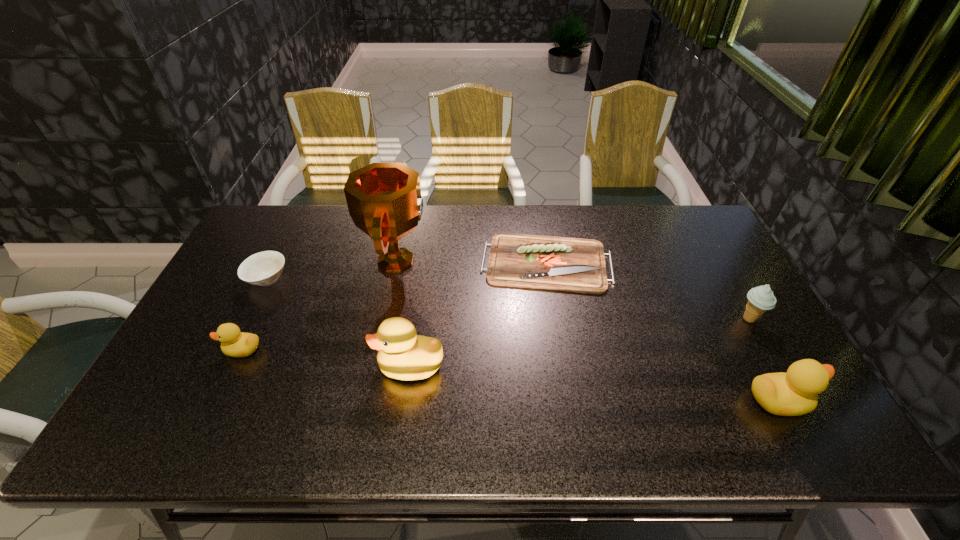
The image size is (960, 540). I want to click on the third shortest object, so click(234, 343).

You are a GUI agent. You are given a task and a screenshot of the screen. Output one action in this format:
    pyautogui.click(x=<x>, y=<y>)
    Task: Click on the shortest duckling
    This screenshot has width=960, height=540.
    Given the screenshot: What is the action you would take?
    pyautogui.click(x=234, y=343)

Identify the location of the second duckling from right to left. (402, 354).

Locate an element on the screen. The image size is (960, 540). the second tallest duckling is located at coordinates (794, 393).

I want to click on bowl, so (x=263, y=268).

Where is `the shortest object`? the shortest object is located at coordinates (566, 264).

You are a GUI agent. You are given a task and a screenshot of the screen. Output one action in this format:
    pyautogui.click(x=<x>, y=<y>)
    Task: Click on the chopping board
    This screenshot has width=960, height=540.
    Given the screenshot: What is the action you would take?
    566,264

Where is `the tallest object`? the tallest object is located at coordinates (384, 200).

Identify the location of icecream. (760, 299).

Where is `blank area located on the face of the third shortest object`? This screenshot has width=960, height=540. blank area located on the face of the third shortest object is located at coordinates (197, 349).